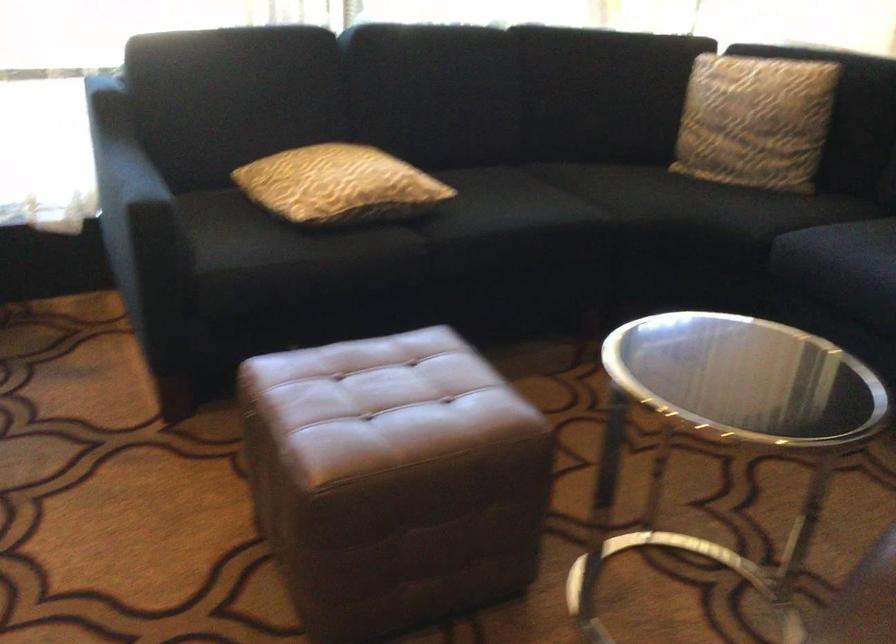
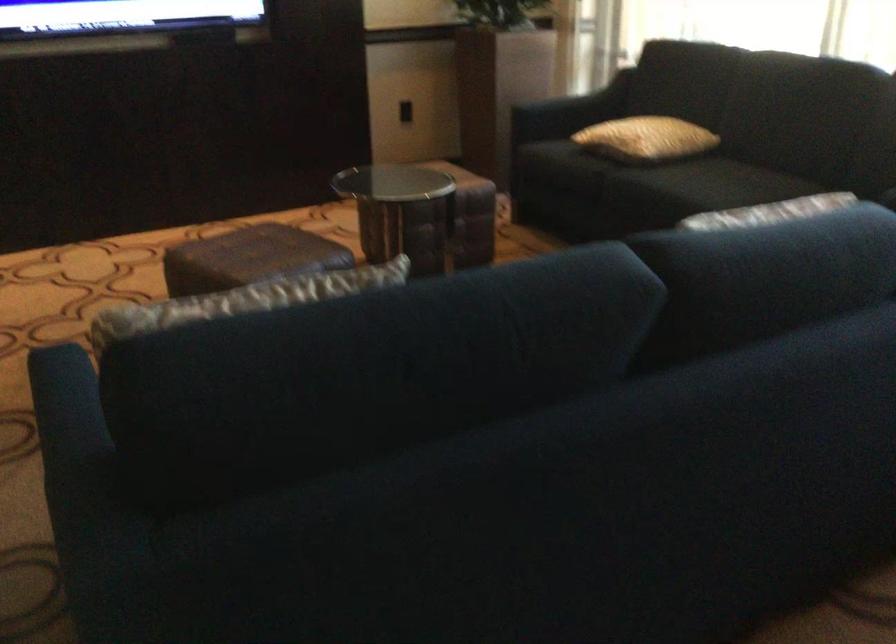
Where in the second image is the point corresponding to (416,180) from the first image?

(645, 138)